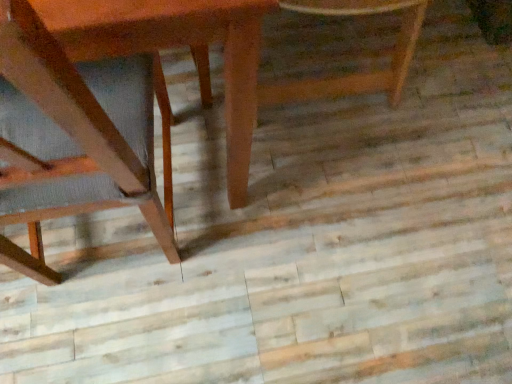
Question: Is wooden chair at left, which is the first chair from left to right, facing away from wooden chair at center, the 1th chair when ordered from right to left?

Choices:
 (A) yes
 (B) no

Answer: (B)

Question: Does wooden chair at left, which is the first chair from left to right, come in front of wooden chair at center, the 2th chair positioned from the left?

Choices:
 (A) yes
 (B) no

Answer: (A)

Question: Does wooden chair at left, placed as the second chair when sorted from right to left, have a lesser height compared to wooden chair at center, the 2th chair positioned from the left?

Choices:
 (A) no
 (B) yes

Answer: (A)

Question: Does wooden chair at left, which is the first chair from left to right, appear on the left side of wooden chair at center, the 2th chair positioned from the left?

Choices:
 (A) yes
 (B) no

Answer: (A)

Question: From a real-world perspective, is wooden chair at left, placed as the second chair when sorted from right to left, positioned over wooden chair at center, the 1th chair when ordered from right to left, based on gravity?

Choices:
 (A) no
 (B) yes

Answer: (B)

Question: Considering the relative sizes of wooden chair at left, which is the first chair from left to right, and wooden chair at center, the 2th chair positioned from the left, in the image provided, is wooden chair at left, which is the first chair from left to right, taller than wooden chair at center, the 2th chair positioned from the left,?

Choices:
 (A) no
 (B) yes

Answer: (B)

Question: From the image's perspective, is wooden table at left under wooden chair at center, the 2th chair positioned from the left?

Choices:
 (A) yes
 (B) no

Answer: (A)

Question: Is wooden table at left in front of wooden chair at center, the 1th chair when ordered from right to left?

Choices:
 (A) no
 (B) yes

Answer: (B)

Question: Does wooden table at left turn towards wooden chair at center, the 1th chair when ordered from right to left?

Choices:
 (A) no
 (B) yes

Answer: (A)

Question: Can you confirm if wooden table at left is bigger than wooden chair at center, the 1th chair when ordered from right to left?

Choices:
 (A) yes
 (B) no

Answer: (A)

Question: Is wooden table at left to the left of wooden chair at center, the 1th chair when ordered from right to left, from the viewer's perspective?

Choices:
 (A) yes
 (B) no

Answer: (A)

Question: Does wooden table at left have a greater height compared to wooden chair at center, the 1th chair when ordered from right to left?

Choices:
 (A) no
 (B) yes

Answer: (B)

Question: Is wooden table at left beside wooden chair at left, which is the first chair from left to right?

Choices:
 (A) yes
 (B) no

Answer: (B)